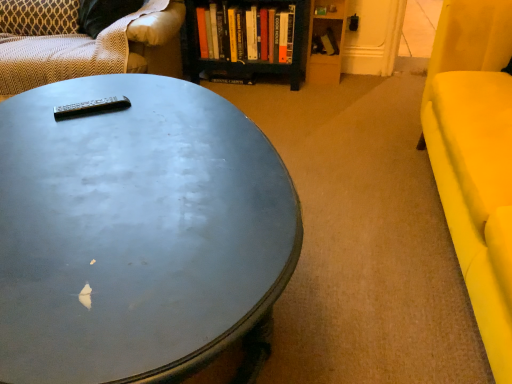
At what (x,y) coordinates should I click in order to perform the action: click on free space to the back side of matte yellow armchair at right. Please return your answer as a coordinate pair (x, y). The width and height of the screenshot is (512, 384). Looking at the image, I should click on (353, 133).